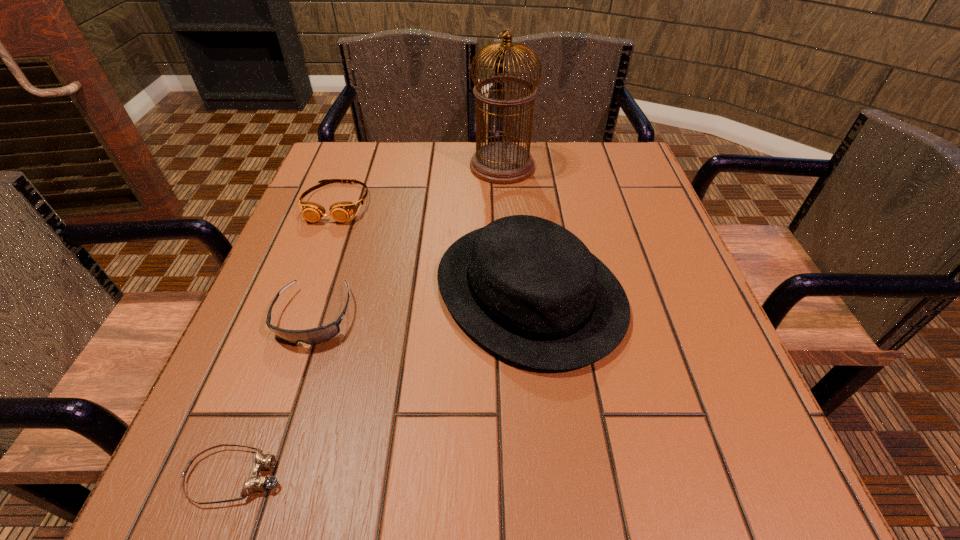
Identify which object is the second closest to the farthest goggles. Please provide its 2D coordinates. Your answer should be formatted as a tuple, i.e. [(x, y)], where the tuple contains the x and y coordinates of a point satisfying the conditions above.

[(314, 336)]

This screenshot has height=540, width=960. Find the location of `the third closest goggles relative to the fedora`. the third closest goggles relative to the fedora is located at coordinates (255, 483).

Point out which goggles is positioned as the nearest to the farthest goggles. Please provide its 2D coordinates. Your answer should be formatted as a tuple, i.e. [(x, y)], where the tuple contains the x and y coordinates of a point satisfying the conditions above.

[(314, 336)]

Locate an element on the screen. blank space that satisfies the following two spatial constraints: 1. on the front-facing side of the tallest object; 2. with the lenses facing forward on the farthest goggles is located at coordinates (505, 203).